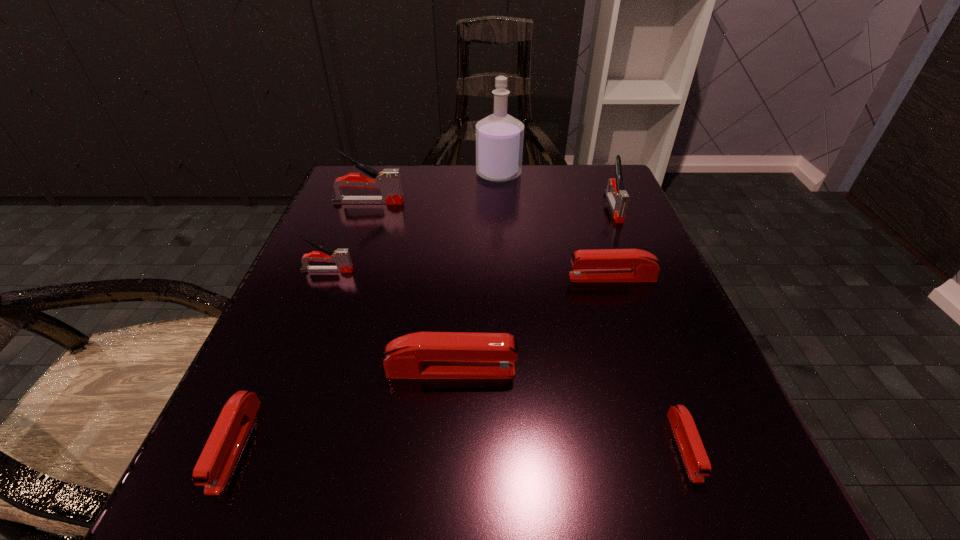
The height and width of the screenshot is (540, 960). What are the coordinates of `vacant space located 0.120m on the front-facing side of the third smallest red stapler` in the screenshot? It's located at (500, 278).

Locate an element on the screen. The image size is (960, 540). free space located on the front-facing side of the third smallest red stapler is located at coordinates (448, 278).

Where is `vacant area situated 0.310m on the front-facing side of the third smallest red stapler`? This screenshot has height=540, width=960. vacant area situated 0.310m on the front-facing side of the third smallest red stapler is located at coordinates (391, 278).

What are the coordinates of `perfume located at the far edge` in the screenshot? It's located at (499, 137).

Locate an element on the screen. This screenshot has width=960, height=540. object located in the far left corner section of the desktop is located at coordinates (388, 181).

Locate an element on the screen. The width and height of the screenshot is (960, 540). object that is at the near left corner is located at coordinates (215, 464).

You are a GUI agent. You are given a task and a screenshot of the screen. Output one action in this format:
    pyautogui.click(x=<x>, y=<y>)
    Task: Click on the object located at the far right corner
    
    Given the screenshot: What is the action you would take?
    pyautogui.click(x=618, y=198)

Find the location of `object that is at the near right corner`. object that is at the near right corner is located at coordinates (691, 447).

Where is `free space at the far edge of the desktop`? The image size is (960, 540). free space at the far edge of the desktop is located at coordinates click(540, 193).

You are a GUI agent. You are given a task and a screenshot of the screen. Output one action in this format:
    pyautogui.click(x=<x>, y=<y>)
    Task: Click on the vacant region at the near edge of the desktop
    Image resolution: width=960 pixels, height=540 pixels.
    Given the screenshot: What is the action you would take?
    pyautogui.click(x=473, y=468)